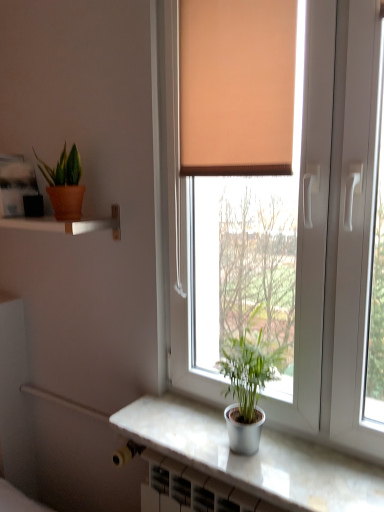
Locate an element on the screen. The image size is (384, 512). vacant space underneath white plastic window at center (from a real-world perspective) is located at coordinates (261, 436).